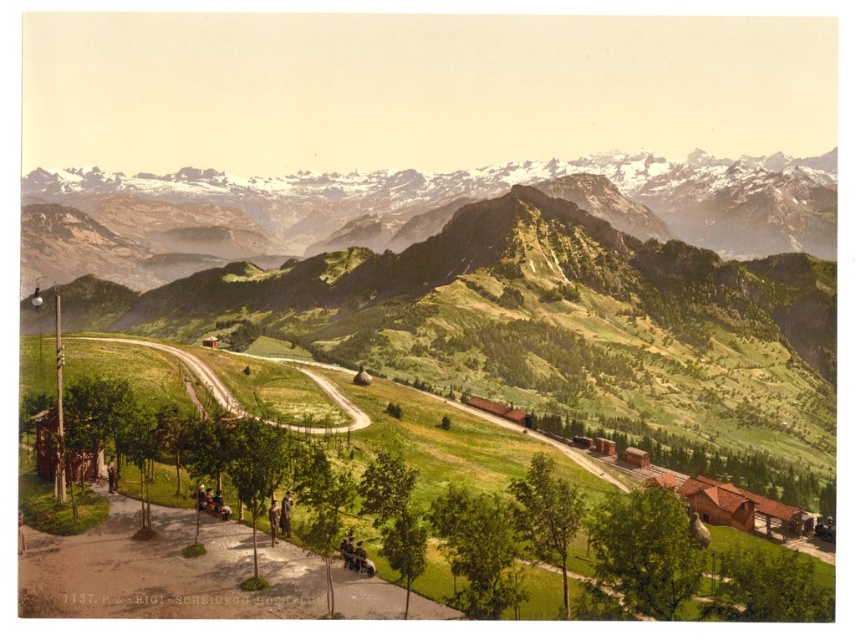
You are standing on the brown wooden houses at lower right and want to reach the green grassy mountain at upper center. Which direction should you move to get there?

You should move upwards to reach the green grassy mountain at upper center from the brown wooden houses at lower right since the mountain is located above the houses.

You are planning a hiking trip and want to know if the green grassy hillside at center has enough space for a picnic area compared to the brown wooden houses at lower right. Can you determine which area is bigger?

The green grassy hillside at center is larger in size than the brown wooden houses at lower right, so the hillside would have more space for a picnic area.